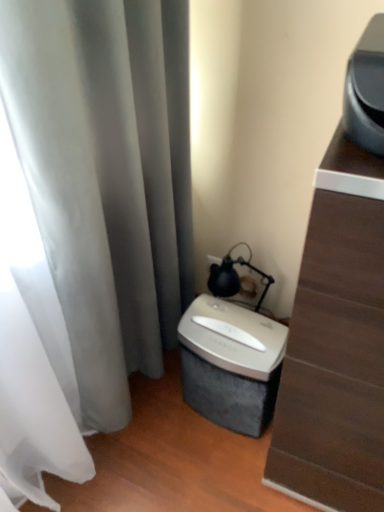
Question: Considering the relative sizes of silver metallic shredder at lower center and matte black lamp at upper right in the image provided, is silver metallic shredder at lower center shorter than matte black lamp at upper right?

Choices:
 (A) yes
 (B) no

Answer: (B)

Question: Considering the relative sizes of silver metallic shredder at lower center and matte black lamp at upper right in the image provided, is silver metallic shredder at lower center wider than matte black lamp at upper right?

Choices:
 (A) yes
 (B) no

Answer: (A)

Question: From the image's perspective, is silver metallic shredder at lower center located beneath matte black lamp at upper right?

Choices:
 (A) no
 (B) yes

Answer: (B)

Question: Does silver metallic shredder at lower center come behind matte black lamp at upper right?

Choices:
 (A) no
 (B) yes

Answer: (A)

Question: Does silver metallic shredder at lower center have a larger size compared to matte black lamp at upper right?

Choices:
 (A) yes
 (B) no

Answer: (A)

Question: Can you confirm if silver metallic shredder at lower center is thinner than matte black lamp at upper right?

Choices:
 (A) yes
 (B) no

Answer: (B)

Question: Considering the relative sizes of silver metallic shredder at lower center and matte black lamp at upper right in the image provided, is silver metallic shredder at lower center taller than matte black lamp at upper right?

Choices:
 (A) yes
 (B) no

Answer: (A)

Question: Does silver metallic shredder at lower center touch matte black lamp at upper right?

Choices:
 (A) yes
 (B) no

Answer: (B)

Question: Would you say silver metallic shredder at lower center is a long distance from matte black lamp at upper right?

Choices:
 (A) yes
 (B) no

Answer: (B)

Question: Is silver metallic shredder at lower center at the left side of matte black lamp at upper right?

Choices:
 (A) yes
 (B) no

Answer: (A)

Question: Does silver metallic shredder at lower center have a smaller size compared to matte black lamp at upper right?

Choices:
 (A) yes
 (B) no

Answer: (B)

Question: Does silver metallic shredder at lower center turn towards matte black lamp at upper right?

Choices:
 (A) no
 (B) yes

Answer: (A)

Question: Is silver metallic shredder at lower center outside silver metallic shredder at lower center?

Choices:
 (A) yes
 (B) no

Answer: (A)